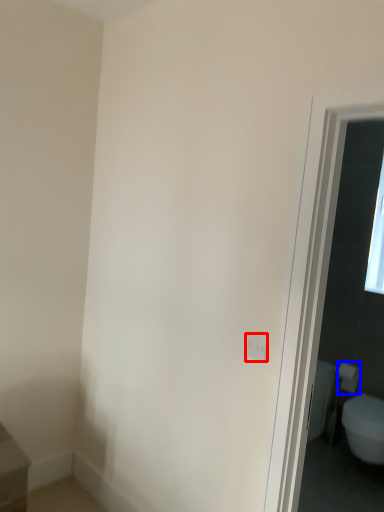
Question: Which of the following is the farthest to the observer, electric outlet (highlighted by a red box) or toilet paper (highlighted by a blue box)?

Choices:
 (A) electric outlet
 (B) toilet paper

Answer: (B)